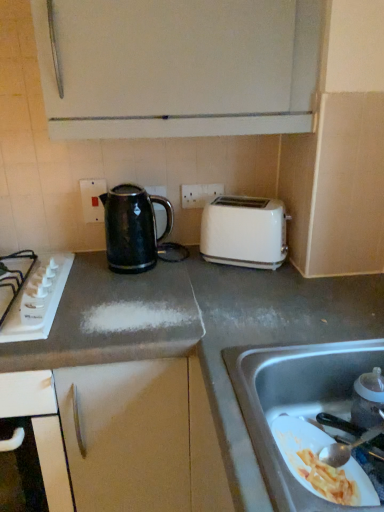
You are a GUI agent. You are given a task and a screenshot of the screen. Output one action in this format:
    pyautogui.click(x=<x>, y=<y>)
    Task: Click on the blank space above matte black kettle at center (from a real-world perspective)
    This screenshot has width=384, height=512.
    Given the screenshot: What is the action you would take?
    pyautogui.click(x=128, y=292)